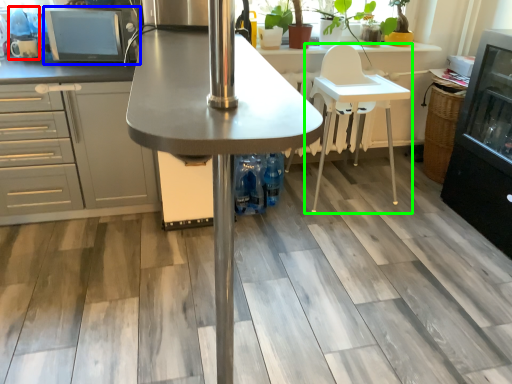
Question: Which is farther away from appliance (highlighted by a red box)? appliance (highlighted by a blue box) or chair (highlighted by a green box)?

Choices:
 (A) appliance
 (B) chair

Answer: (B)